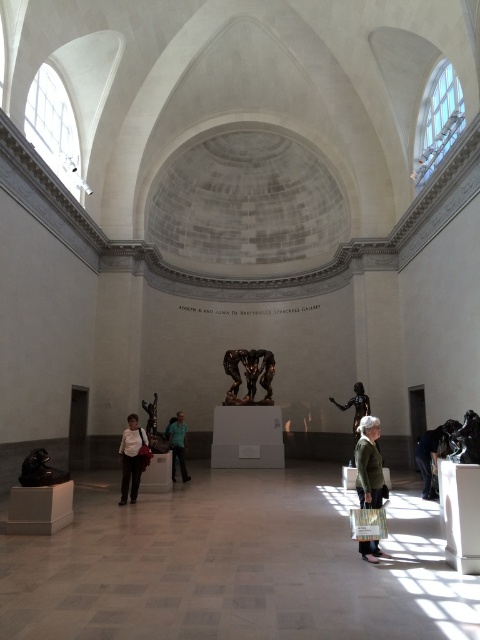
You are standing in the grand gallery and want to take a photo of both the central bronze sculpture and the smaller sculptures around it. You notice two points marked as point 1 at coordinates point (143, 429) and point 2 at coordinates point (22, 481). Which point should you focus on first if you want to ensure both areas are in focus?

You should focus on point 1 at coordinates point (143, 429) first because it is closer to the camera than point 2 at coordinates point (22, 481). By focusing on the closer point, the depth of field may cover both areas more effectively.

You are standing in the gallery and want to move from your current position to the entrance located at point [355,438]. There is an obstacle at point [39,452]. Will you pass in front of or behind the obstacle when moving towards the entrance?

Since point [39,452] is in front of point [355,438], you will pass in front of the obstacle at point [39,452] when moving towards the entrance at point [355,438].